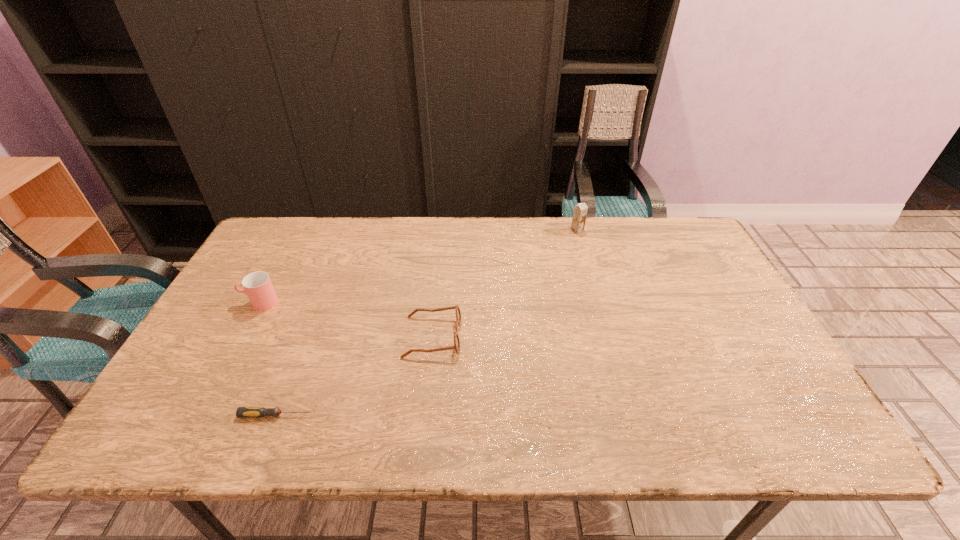
You are a GUI agent. You are given a task and a screenshot of the screen. Output one action in this format:
    pyautogui.click(x=<x>, y=<y>)
    Task: Click on the object that is the third nearest to the screwdriver
    Image resolution: width=960 pixels, height=540 pixels.
    Given the screenshot: What is the action you would take?
    pyautogui.click(x=580, y=211)

Locate which object ranks third in proximity to the screwdriver. Please provide its 2D coordinates. Your answer should be formatted as a tuple, i.e. [(x, y)], where the tuple contains the x and y coordinates of a point satisfying the conditions above.

[(580, 211)]

The width and height of the screenshot is (960, 540). In order to click on free location that satisfies the following two spatial constraints: 1. on the side of the leftmost object with the handle; 2. on the left side of the rightmost object in this screenshot , I will do [299, 230].

The image size is (960, 540). In order to click on free spot that satisfies the following two spatial constraints: 1. on the side of the second farthest object with the handle; 2. on the back side of the chocolate milk in this screenshot , I will do `click(299, 230)`.